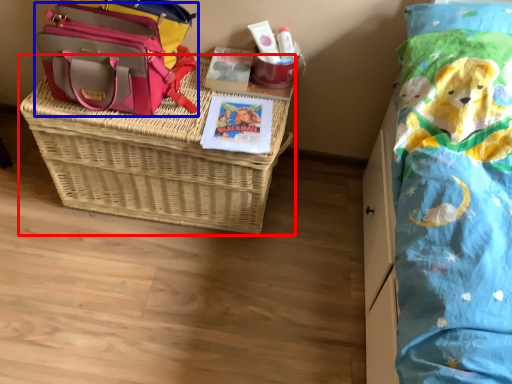
Question: Which object is further to the camera taking this photo, picnic basket (highlighted by a red box) or shoulder bag (highlighted by a blue box)?

Choices:
 (A) picnic basket
 (B) shoulder bag

Answer: (B)